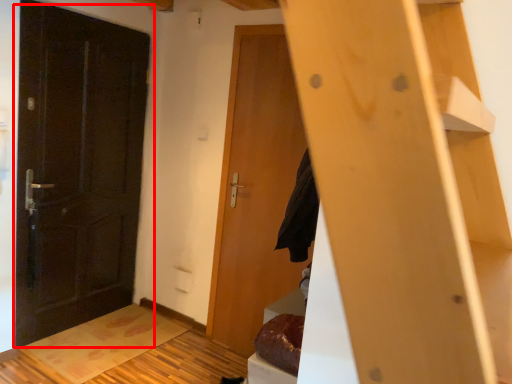
Question: Where is door (annotated by the red box) located in relation to door in the image?

Choices:
 (A) left
 (B) right

Answer: (A)